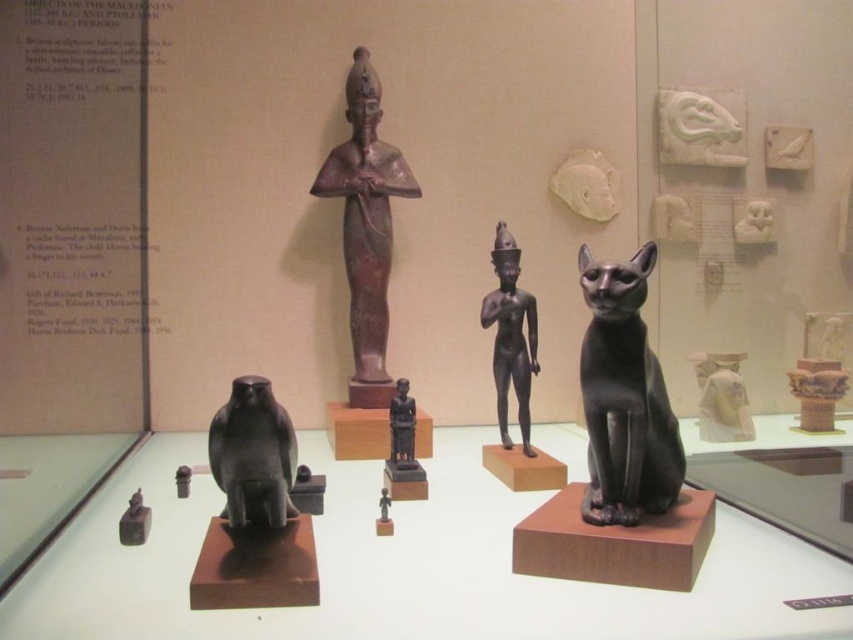
Question: Which is nearer to the black glossy bird at lower left?

Choices:
 (A) white glossy statue at upper right
 (B) matte black figurine at center
 (C) matte black cat at center

Answer: (C)

Question: Can you confirm if bronze statue at center is bigger than black glossy bird at lower left?

Choices:
 (A) yes
 (B) no

Answer: (A)

Question: Which object is the closest to the bronze statue at center?

Choices:
 (A) white glossy statue at upper right
 (B) matte black figurine at center

Answer: (B)

Question: Is bronze statue at center further to the viewer compared to white glossy statue at upper right?

Choices:
 (A) yes
 (B) no

Answer: (A)

Question: Which point appears farthest from the camera in this image?

Choices:
 (A) (403, 451)
 (B) (346, 196)
 (C) (722, 380)

Answer: (B)

Question: Is matte black cat at center smaller than black polished statue at center?

Choices:
 (A) no
 (B) yes

Answer: (A)